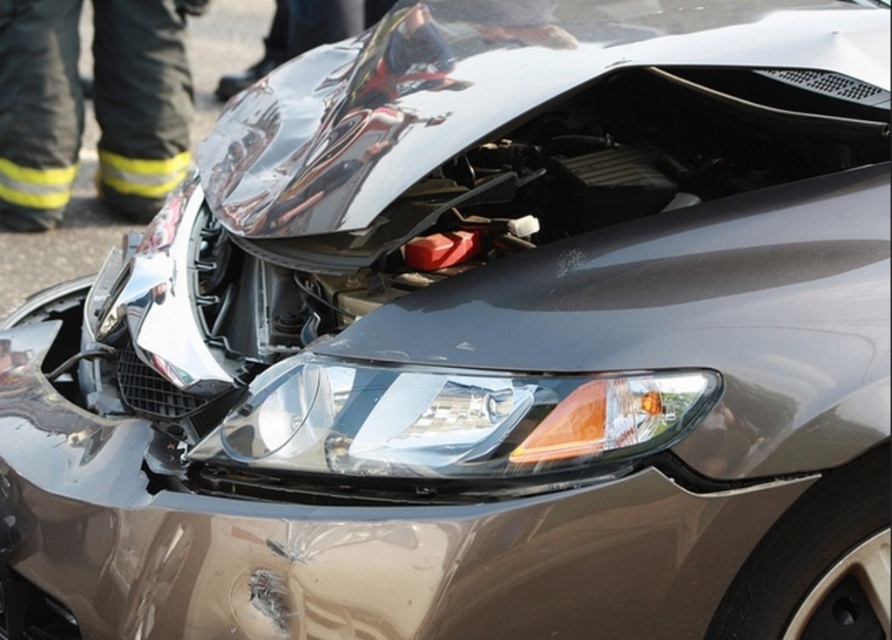
Question: Can you confirm if clear plastic headlight at center is smaller than black fabric pants at left?

Choices:
 (A) no
 (B) yes

Answer: (B)

Question: Can you confirm if clear plastic headlight at center is positioned above black fabric pants at left?

Choices:
 (A) yes
 (B) no

Answer: (B)

Question: Which of the following is the closest to the observer?

Choices:
 (A) (558, 394)
 (B) (15, 209)

Answer: (A)

Question: Is clear plastic headlight at center above black fabric pants at left?

Choices:
 (A) yes
 (B) no

Answer: (B)

Question: Which object is closer to the camera taking this photo?

Choices:
 (A) black fabric pants at left
 (B) clear plastic headlight at center

Answer: (B)